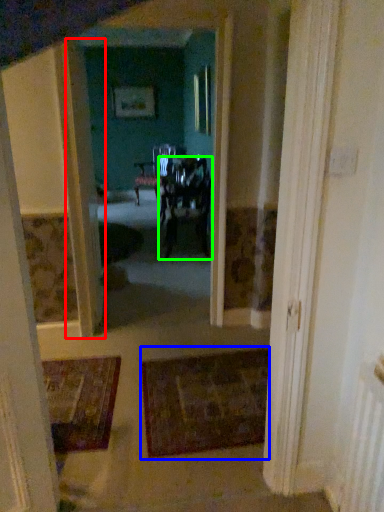
Question: Which object is positioned closest to door (highlighted by a red box)? Select from doormat (highlighted by a blue box) and chair (highlighted by a green box).

Choices:
 (A) doormat
 (B) chair

Answer: (A)